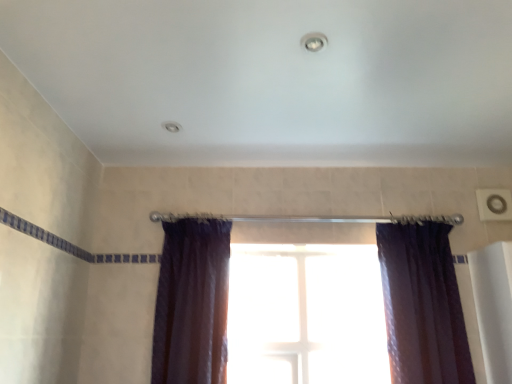
The width and height of the screenshot is (512, 384). What do you see at coordinates (422, 305) in the screenshot?
I see `satin purple curtain at right, the 1th curtain from the right` at bounding box center [422, 305].

You are a GUI agent. You are given a task and a screenshot of the screen. Output one action in this format:
    pyautogui.click(x=<x>, y=<y>)
    Task: Click on the satin dark purple curtain at center, placed as the 1th curtain when sorted from left to right
    Image resolution: width=512 pixels, height=384 pixels.
    Given the screenshot: What is the action you would take?
    point(192,303)

The height and width of the screenshot is (384, 512). Find the location of `transparent glass window at center`. transparent glass window at center is located at coordinates (306, 315).

Find the location of a particular element. satin purple curtain at right, the 1th curtain from the right is located at coordinates pyautogui.click(x=422, y=305).

The image size is (512, 384). I want to click on window located on the right of satin dark purple curtain at center, placed as the 1th curtain when sorted from left to right, so click(x=306, y=315).

Can you confirm if satin dark purple curtain at center, positioned as the 2th curtain in right-to-left order, is positioned to the left of transparent glass window at center?

Indeed, satin dark purple curtain at center, positioned as the 2th curtain in right-to-left order, is positioned on the left side of transparent glass window at center.

Considering the relative positions of satin dark purple curtain at center, positioned as the 2th curtain in right-to-left order, and transparent glass window at center in the image provided, is satin dark purple curtain at center, positioned as the 2th curtain in right-to-left order, in front of transparent glass window at center?

Yes.

Which of these two, satin dark purple curtain at center, placed as the 1th curtain when sorted from left to right, or transparent glass window at center, is wider?

Wider between the two is satin dark purple curtain at center, placed as the 1th curtain when sorted from left to right.

Is satin purple curtain at right, the 1th curtain from the right, turned away from satin dark purple curtain at center, positioned as the 2th curtain in right-to-left order?

No, satin purple curtain at right, the 1th curtain from the right,'s orientation is not away from satin dark purple curtain at center, positioned as the 2th curtain in right-to-left order.

Who is taller, satin purple curtain at right, the 1th curtain from the right, or satin dark purple curtain at center, placed as the 1th curtain when sorted from left to right?

With more height is satin dark purple curtain at center, placed as the 1th curtain when sorted from left to right.

From the image's perspective, is satin purple curtain at right, the 1th curtain from the right, beneath satin dark purple curtain at center, positioned as the 2th curtain in right-to-left order?

Correct, satin purple curtain at right, the 1th curtain from the right, appears lower than satin dark purple curtain at center, positioned as the 2th curtain in right-to-left order, in the image.

Looking at the image, does satin purple curtain at right, which is the second curtain in left-to-right order, seem bigger or smaller compared to satin dark purple curtain at center, positioned as the 2th curtain in right-to-left order?

Considering their sizes, satin purple curtain at right, which is the second curtain in left-to-right order, takes up more space than satin dark purple curtain at center, positioned as the 2th curtain in right-to-left order.

Does satin dark purple curtain at center, placed as the 1th curtain when sorted from left to right, have a lesser width compared to satin purple curtain at right, the 1th curtain from the right?

No, satin dark purple curtain at center, placed as the 1th curtain when sorted from left to right, is not thinner than satin purple curtain at right, the 1th curtain from the right.

Are satin dark purple curtain at center, positioned as the 2th curtain in right-to-left order, and satin purple curtain at right, the 1th curtain from the right, beside each other?

satin dark purple curtain at center, positioned as the 2th curtain in right-to-left order, is not next to satin purple curtain at right, the 1th curtain from the right, and they're not touching.

Considering their positions, is satin dark purple curtain at center, placed as the 1th curtain when sorted from left to right, located in front of or behind satin purple curtain at right, which is the second curtain in left-to-right order?

satin dark purple curtain at center, placed as the 1th curtain when sorted from left to right, is in front of satin purple curtain at right, which is the second curtain in left-to-right order.

From a real-world perspective, who is located lower, satin dark purple curtain at center, positioned as the 2th curtain in right-to-left order, or satin purple curtain at right, which is the second curtain in left-to-right order?

satin purple curtain at right, which is the second curtain in left-to-right order, from a real-world perspective.

From the image's perspective, would you say satin purple curtain at right, which is the second curtain in left-to-right order, is shown under transparent glass window at center?

Incorrect, from the image's perspective, satin purple curtain at right, which is the second curtain in left-to-right order, is higher than transparent glass window at center.

Considering the relative sizes of satin purple curtain at right, the 1th curtain from the right, and transparent glass window at center in the image provided, is satin purple curtain at right, the 1th curtain from the right, thinner than transparent glass window at center?

In fact, satin purple curtain at right, the 1th curtain from the right, might be wider than transparent glass window at center.

Is the position of satin purple curtain at right, which is the second curtain in left-to-right order, more distant than that of transparent glass window at center?

No, the depth of satin purple curtain at right, which is the second curtain in left-to-right order, is less than that of transparent glass window at center.

From a real-world perspective, is satin purple curtain at right, which is the second curtain in left-to-right order, over transparent glass window at center?

Correct, in the physical world, satin purple curtain at right, which is the second curtain in left-to-right order, is higher than transparent glass window at center.

Consider the image. From a real-world perspective, is transparent glass window at center positioned under satin purple curtain at right, which is the second curtain in left-to-right order, based on gravity?

Yes, from a real-world perspective, transparent glass window at center is beneath satin purple curtain at right, which is the second curtain in left-to-right order.

Considering the relative positions of transparent glass window at center and satin purple curtain at right, which is the second curtain in left-to-right order, in the image provided, is transparent glass window at center to the left of satin purple curtain at right, which is the second curtain in left-to-right order, from the viewer's perspective?

Yes.

Is transparent glass window at center positioned with its back to satin purple curtain at right, which is the second curtain in left-to-right order?

No, transparent glass window at center's orientation is not away from satin purple curtain at right, which is the second curtain in left-to-right order.

Can satin purple curtain at right, the 1th curtain from the right, be found inside transparent glass window at center?

No, transparent glass window at center does not contain satin purple curtain at right, the 1th curtain from the right.

Measure the distance from transparent glass window at center to satin dark purple curtain at center, placed as the 1th curtain when sorted from left to right.

18.04 inches.

Is point (285, 274) in front of point (175, 358)?

No, it is behind (175, 358).

In the scene shown: Could you tell me if transparent glass window at center is turned towards satin dark purple curtain at center, placed as the 1th curtain when sorted from left to right?

No, transparent glass window at center does not turn towards satin dark purple curtain at center, placed as the 1th curtain when sorted from left to right.

From the image's perspective, is transparent glass window at center located beneath satin dark purple curtain at center, placed as the 1th curtain when sorted from left to right?

Correct, transparent glass window at center appears lower than satin dark purple curtain at center, placed as the 1th curtain when sorted from left to right, in the image.

The image size is (512, 384). I want to click on window below the satin dark purple curtain at center, placed as the 1th curtain when sorted from left to right (from a real-world perspective), so click(x=306, y=315).

I want to click on curtain above the satin purple curtain at right, which is the second curtain in left-to-right order (from the image's perspective), so click(192, 303).

Looking at the image, which one is located closer to satin purple curtain at right, which is the second curtain in left-to-right order, satin dark purple curtain at center, positioned as the 2th curtain in right-to-left order, or transparent glass window at center?

Among the two, transparent glass window at center is located nearer to satin purple curtain at right, which is the second curtain in left-to-right order.

Which object lies further to the anchor point transparent glass window at center, satin dark purple curtain at center, positioned as the 2th curtain in right-to-left order, or satin purple curtain at right, the 1th curtain from the right?

satin dark purple curtain at center, positioned as the 2th curtain in right-to-left order, is positioned further to the anchor transparent glass window at center.

From the picture: Estimate the real-world distances between objects in this image. Which object is closer to satin dark purple curtain at center, placed as the 1th curtain when sorted from left to right, transparent glass window at center or satin purple curtain at right, which is the second curtain in left-to-right order?

Among the two, transparent glass window at center is located nearer to satin dark purple curtain at center, placed as the 1th curtain when sorted from left to right.

Consider the image. Based on their spatial positions, is satin purple curtain at right, which is the second curtain in left-to-right order, or transparent glass window at center further from satin dark purple curtain at center, placed as the 1th curtain when sorted from left to right?

satin purple curtain at right, which is the second curtain in left-to-right order.

Considering their positions, is transparent glass window at center positioned closer to satin purple curtain at right, which is the second curtain in left-to-right order, than satin dark purple curtain at center, positioned as the 2th curtain in right-to-left order?

transparent glass window at center lies closer to satin purple curtain at right, which is the second curtain in left-to-right order, than the other object.

Consider the image. Based on their spatial positions, is satin purple curtain at right, the 1th curtain from the right, or satin dark purple curtain at center, placed as the 1th curtain when sorted from left to right, closer to transparent glass window at center?

satin purple curtain at right, the 1th curtain from the right, is positioned closer to the anchor transparent glass window at center.

Where is `window located between satin dark purple curtain at center, positioned as the 2th curtain in right-to-left order, and satin purple curtain at right, the 1th curtain from the right, in the left-right direction`? The height and width of the screenshot is (384, 512). window located between satin dark purple curtain at center, positioned as the 2th curtain in right-to-left order, and satin purple curtain at right, the 1th curtain from the right, in the left-right direction is located at coordinates (306, 315).